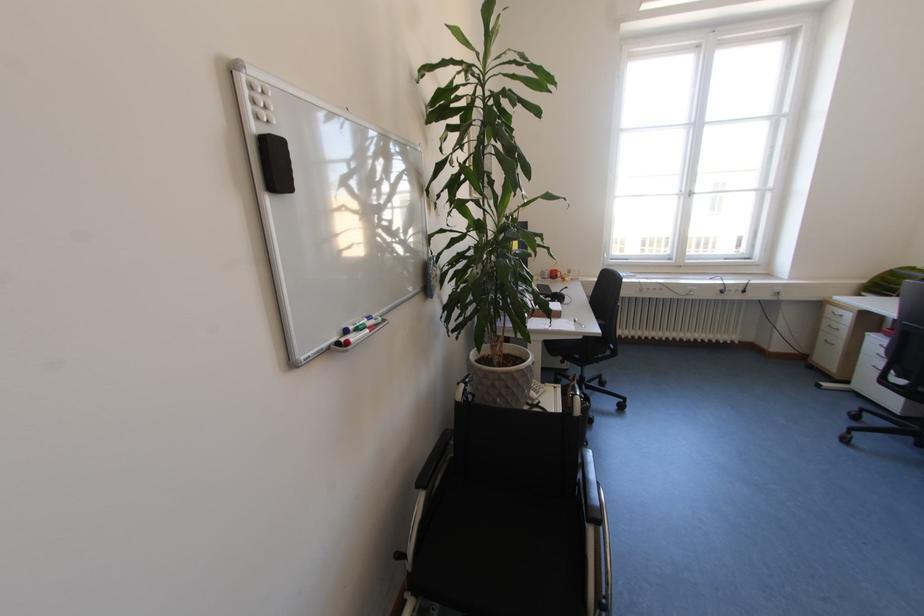
What do you see at coordinates (433, 460) in the screenshot?
I see `the chair armrest` at bounding box center [433, 460].